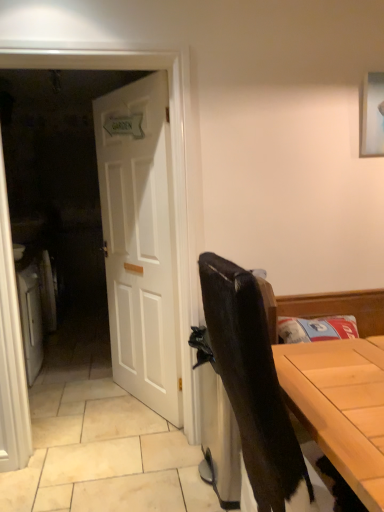
Find the location of a particular element. This screenshot has width=384, height=512. vacant area situated below white wooden door at center (from a real-world perspective) is located at coordinates (138, 403).